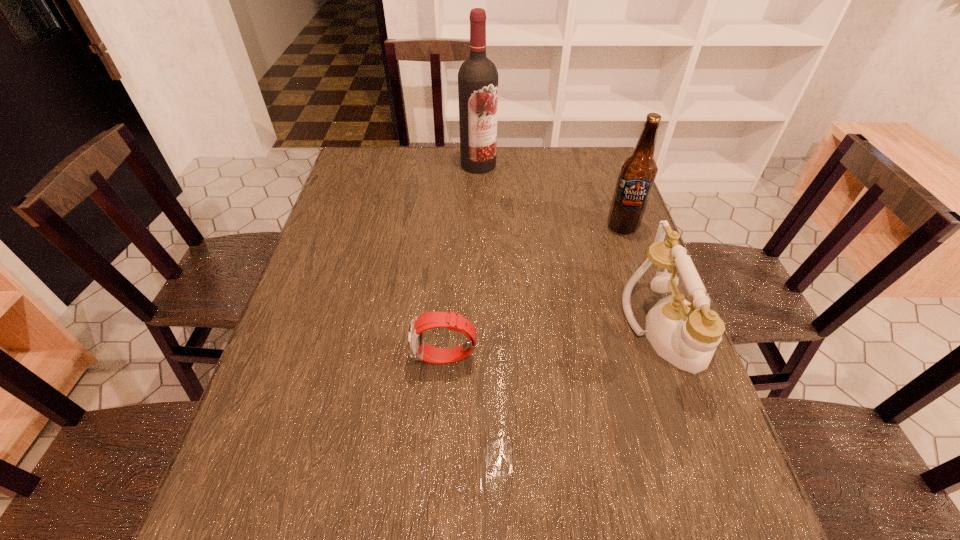
Where is `vacant point located between the shortest object and the wine bottle`? vacant point located between the shortest object and the wine bottle is located at coordinates (462, 261).

Where is `vacant area between the watch and the tallest object`? vacant area between the watch and the tallest object is located at coordinates (462, 261).

I want to click on free area in between the telephone and the wine bottle, so click(573, 247).

I want to click on free spot between the shortest object and the telephone, so click(x=556, y=343).

Identify the location of vacant region between the watch and the third nearest object. 534,292.

Identify which object is the third nearest to the telephone. Please provide its 2D coordinates. Your answer should be formatted as a tuple, i.e. [(x, y)], where the tuple contains the x and y coordinates of a point satisfying the conditions above.

[(478, 79)]

This screenshot has height=540, width=960. I want to click on object that is the third nearest to the third nearest object, so click(418, 350).